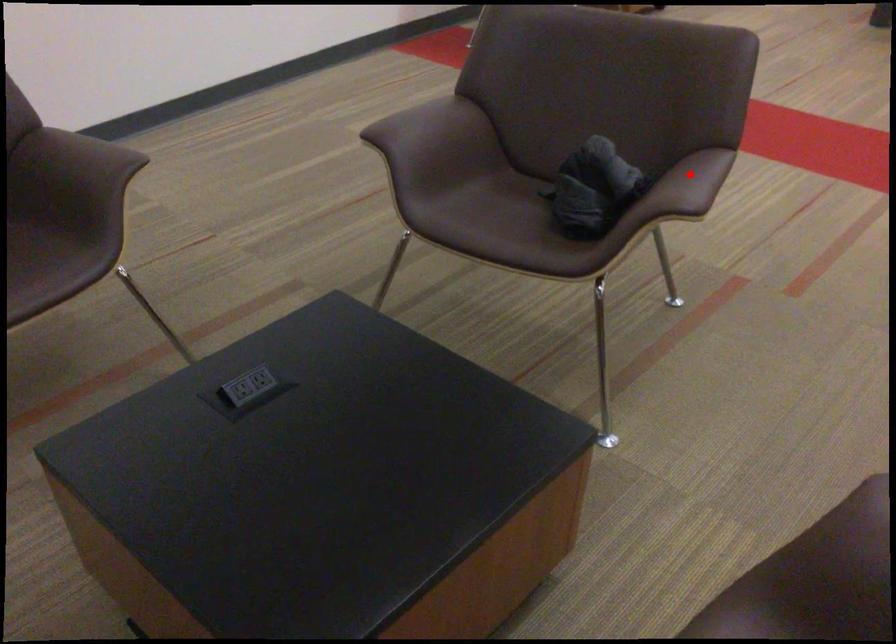
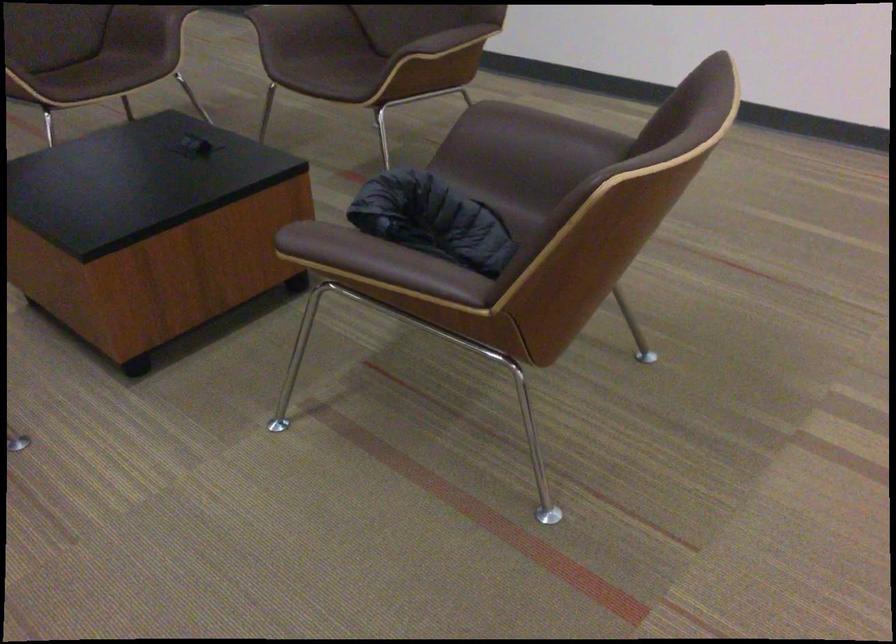
In the second image, find the point that corresponds to the highlighted location in the first image.

(355, 250)